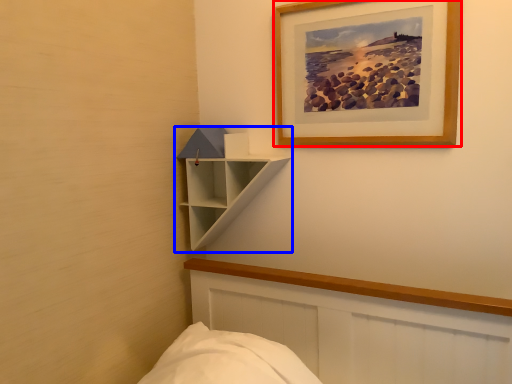
Question: Which object appears farthest to the camera in this image, picture frame (highlighted by a red box) or shelf (highlighted by a blue box)?

Choices:
 (A) picture frame
 (B) shelf

Answer: (B)